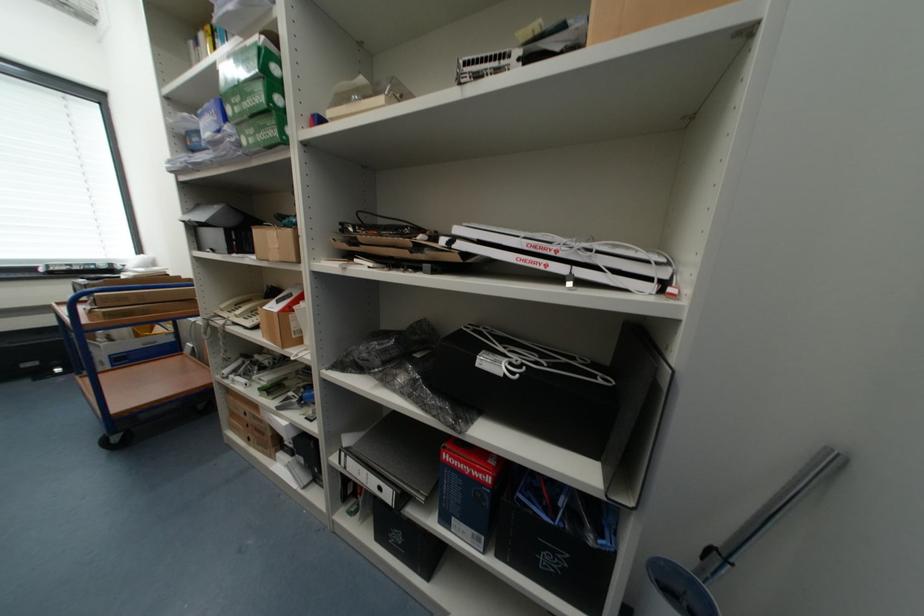
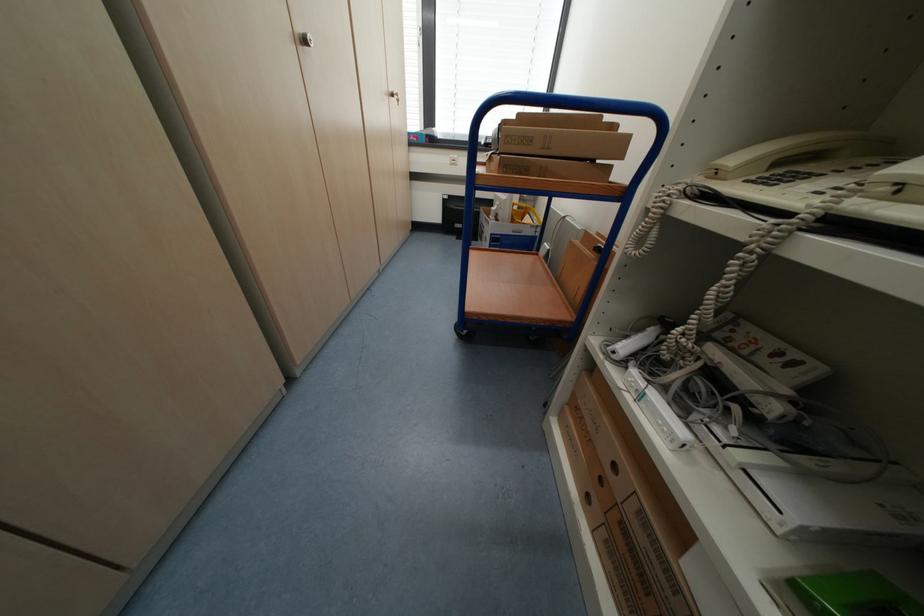
Locate, in the second image, the point that corresponds to the point at 244,379 in the first image.

(662, 398)